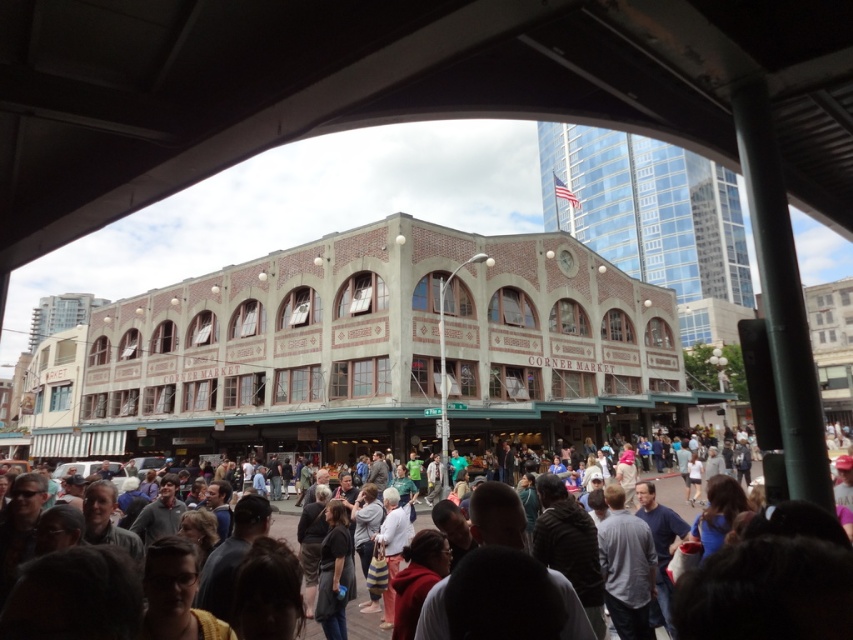
Can you confirm if brick building at center is positioned below dark gray clothing at lower center?

No.

Where is `brick building at center`? The width and height of the screenshot is (853, 640). brick building at center is located at coordinates (374, 353).

Describe the element at coordinates (374, 353) in the screenshot. I see `brick building at center` at that location.

Where is `brick building at center`? The width and height of the screenshot is (853, 640). brick building at center is located at coordinates (374, 353).